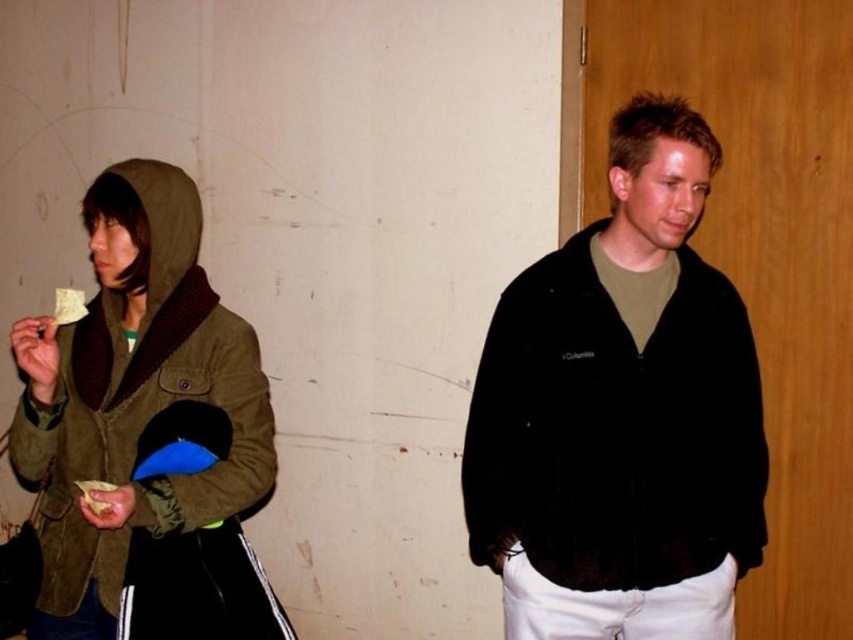
Consider the image. Who is positioned more to the left, olive green suede jacket at left or yellow crumbly food at left?

yellow crumbly food at left is more to the left.

Identify the location of olive green suede jacket at left. The height and width of the screenshot is (640, 853). (142, 403).

Does olive green suede jacket at left appear under yellow paper at left?

Yes.

Does olive green suede jacket at left appear on the left side of yellow paper at left?

Incorrect, olive green suede jacket at left is not on the left side of yellow paper at left.

Is point (38, 474) closer to viewer compared to point (74, 292)?

No.

At what (x,y) coordinates should I click in order to perform the action: click on olive green suede jacket at left. Please return your answer as a coordinate pair (x, y). The width and height of the screenshot is (853, 640). Looking at the image, I should click on (142, 403).

Can you confirm if yellow crumbly food at left is positioned below yellow paper at left?

Correct, yellow crumbly food at left is located below yellow paper at left.

Looking at this image, does yellow crumbly food at left appear on the left side of yellow paper at left?

No, yellow crumbly food at left is not to the left of yellow paper at left.

The image size is (853, 640). Describe the element at coordinates (96, 496) in the screenshot. I see `yellow crumbly food at left` at that location.

Where is `yellow crumbly food at left`? yellow crumbly food at left is located at coordinates (96, 496).